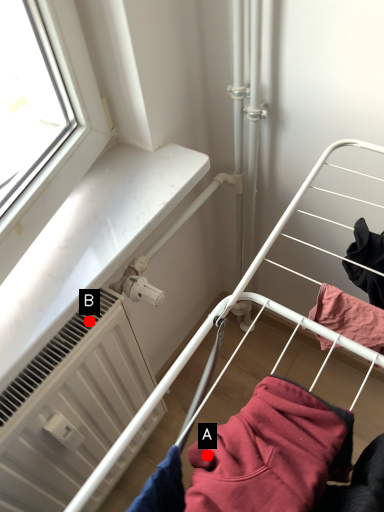
Question: Two points are circled on the image, labeled by A and B beside each circle. Which point is farther to the camera?

Choices:
 (A) A is further
 (B) B is further

Answer: (B)